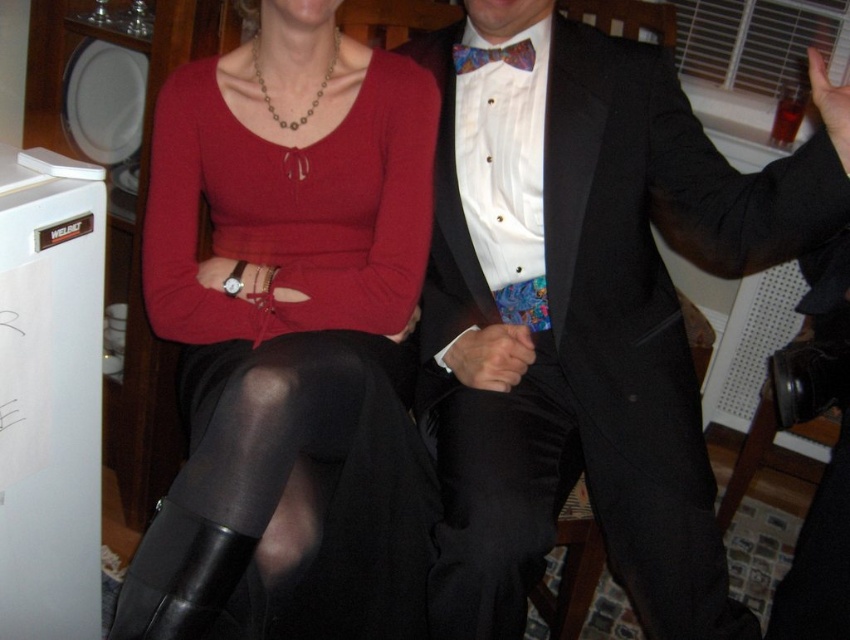
Is black sheer tights at lower center smaller than matte black hand at upper right?

No.

The width and height of the screenshot is (850, 640). Describe the element at coordinates (310, 483) in the screenshot. I see `black sheer tights at lower center` at that location.

Locate an element on the screen. The height and width of the screenshot is (640, 850). black sheer tights at lower center is located at coordinates (310, 483).

Does black satin pants at center appear over matte black hand at upper right?

No, black satin pants at center is not above matte black hand at upper right.

Which is in front, point (451, 465) or point (824, 93)?

Point (824, 93) is more forward.

Describe the element at coordinates (587, 492) in the screenshot. I see `black satin pants at center` at that location.

Locate an element on the screen. Image resolution: width=850 pixels, height=640 pixels. black satin pants at center is located at coordinates (587, 492).

Is point (848, 176) positioned before point (527, 58)?

Yes, point (848, 176) is closer to viewer.

Does matte black hand at upper right appear under multicolored silk bow tie at center?

Correct, matte black hand at upper right is located below multicolored silk bow tie at center.

Between point (847, 157) and point (527, 44), which one is positioned in front?

Point (847, 157) is more forward.

The image size is (850, 640). What are the coordinates of `matte black hand at upper right` in the screenshot? It's located at click(830, 106).